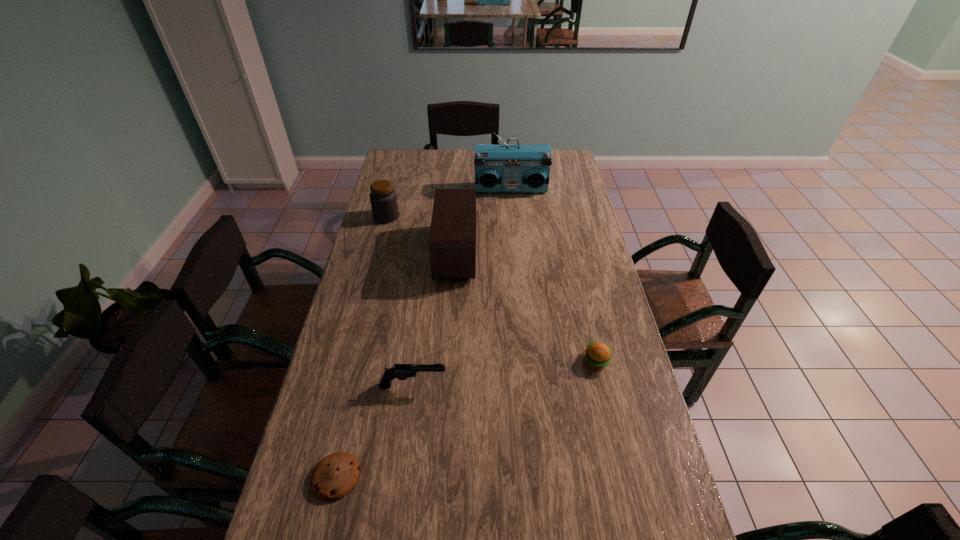
In order to click on the tallest object in this screenshot , I will do [498, 168].

Locate an element on the screen. The image size is (960, 540). the farthest object is located at coordinates (498, 168).

Identify the location of the third farthest object. (452, 240).

This screenshot has width=960, height=540. Find the location of `the fifth shortest object`. the fifth shortest object is located at coordinates (452, 240).

The image size is (960, 540). In order to click on the fifth nearest object in this screenshot , I will do `click(383, 199)`.

The image size is (960, 540). In order to click on the third tallest object in this screenshot , I will do `click(383, 199)`.

At what (x,y) coordinates should I click in order to perform the action: click on the third shortest object. Please return your answer as a coordinate pair (x, y). Looking at the image, I should click on coord(400,371).

I want to click on the fifth farthest object, so (x=400, y=371).

Identify the location of the third nearest object. (598, 355).

The height and width of the screenshot is (540, 960). What are the coordinates of `the rightmost object` in the screenshot? It's located at (598, 355).